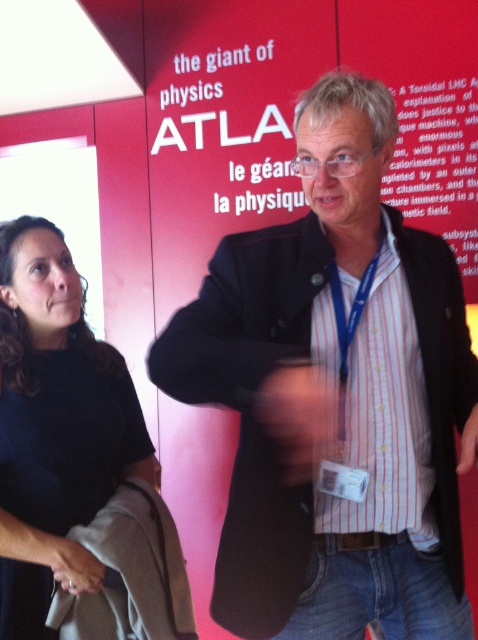
Between striped cotton shirt at center and black matte shirt at upper left, which one appears on the right side from the viewer's perspective?

From the viewer's perspective, striped cotton shirt at center appears more on the right side.

Is striped cotton shirt at center in front of black matte shirt at upper left?

That is True.

You are a GUI agent. You are given a task and a screenshot of the screen. Output one action in this format:
    pyautogui.click(x=<x>, y=<y>)
    Task: Click on the striped cotton shirt at center
    The width and height of the screenshot is (478, 640).
    Given the screenshot: What is the action you would take?
    pyautogui.click(x=336, y=396)